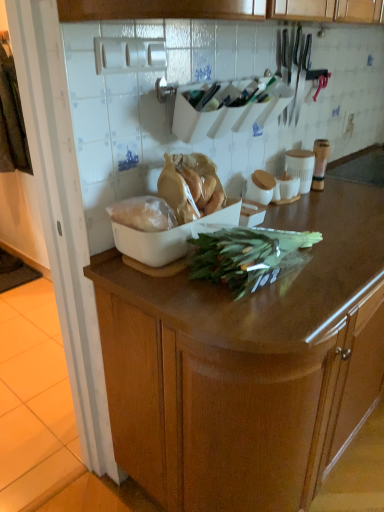
In order to click on free spot in front of green leafy at center in this screenshot , I will do `click(262, 316)`.